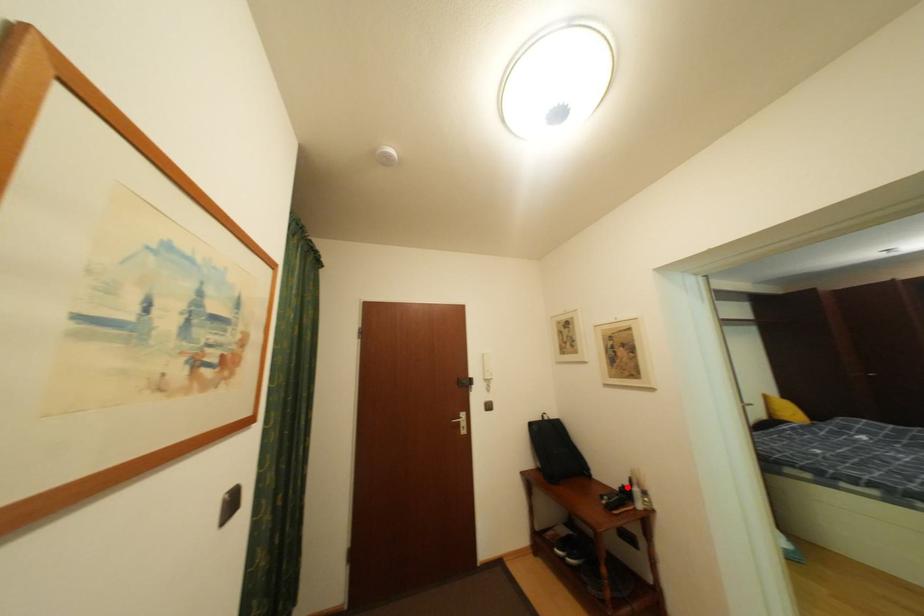
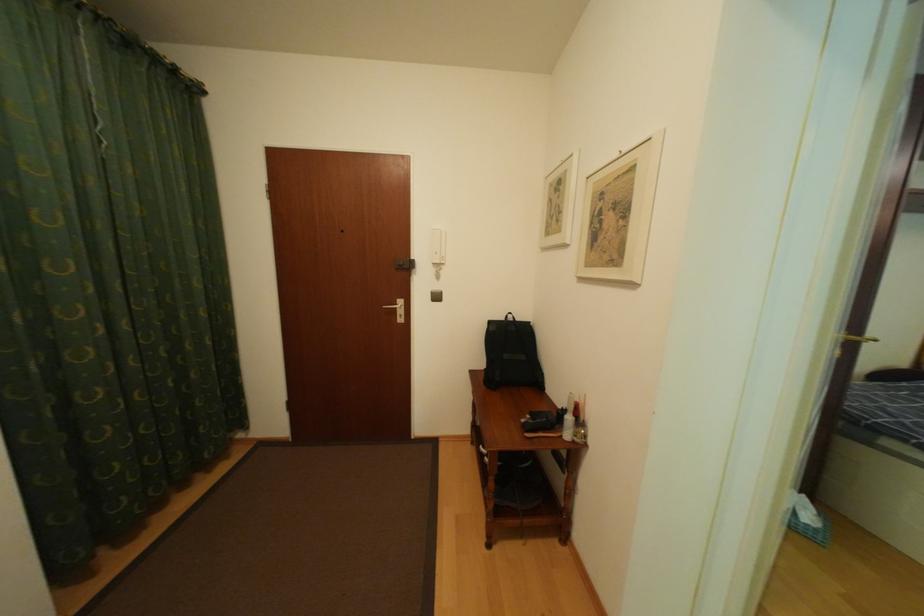
In the second image, find the point that corresponds to the highlighted location in the first image.

(572, 408)